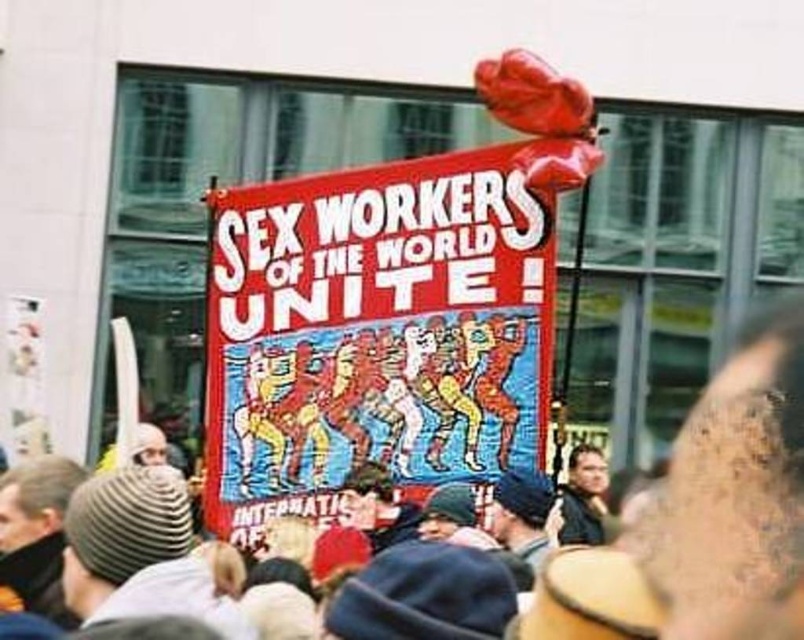
Question: Which of the following is the closest to the observer?

Choices:
 (A) (535, 515)
 (B) (571, 483)
 (C) (780, 429)
 (D) (361, 374)

Answer: (C)

Question: Estimate the real-world distances between objects in this image. Which object is closer to the dark blue knit cap at center?

Choices:
 (A) brown leather jacket at center
 (B) red fabric banner at center

Answer: (B)

Question: Which point is farther to the camera?

Choices:
 (A) (535, 545)
 (B) (219, 522)
 (C) (687, 433)

Answer: (C)

Question: Is red fabric banner at center to the left of dark brown leather jacket at lower right from the viewer's perspective?

Choices:
 (A) no
 (B) yes

Answer: (B)

Question: Does brown leather jacket at center have a larger size compared to dark blue knit cap at center?

Choices:
 (A) yes
 (B) no

Answer: (A)

Question: Observing the image, what is the correct spatial positioning of brown leather jacket at center in reference to dark blue knit cap at center?

Choices:
 (A) above
 (B) below

Answer: (A)